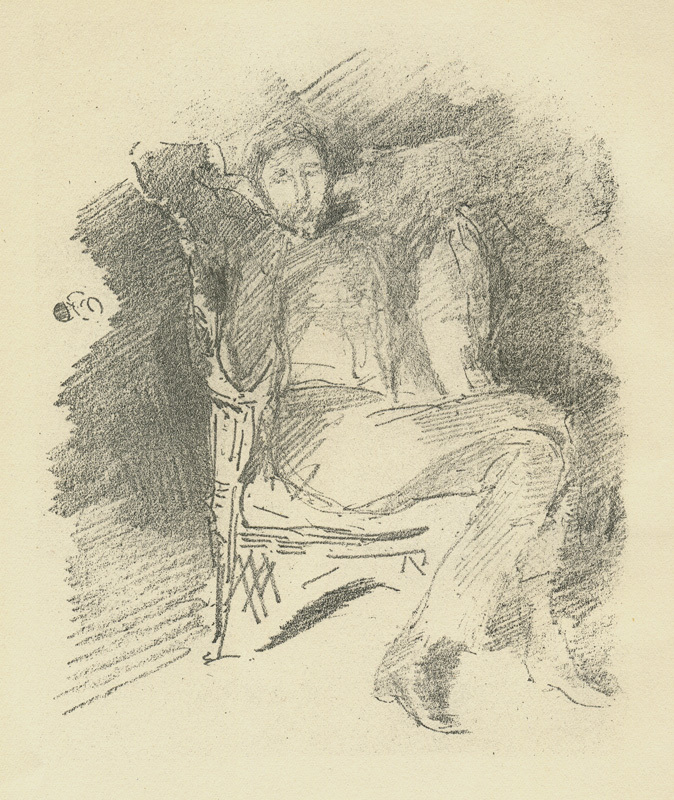
Find the location of a particular element. The height and width of the screenshot is (800, 674). wall is located at coordinates (137, 382).